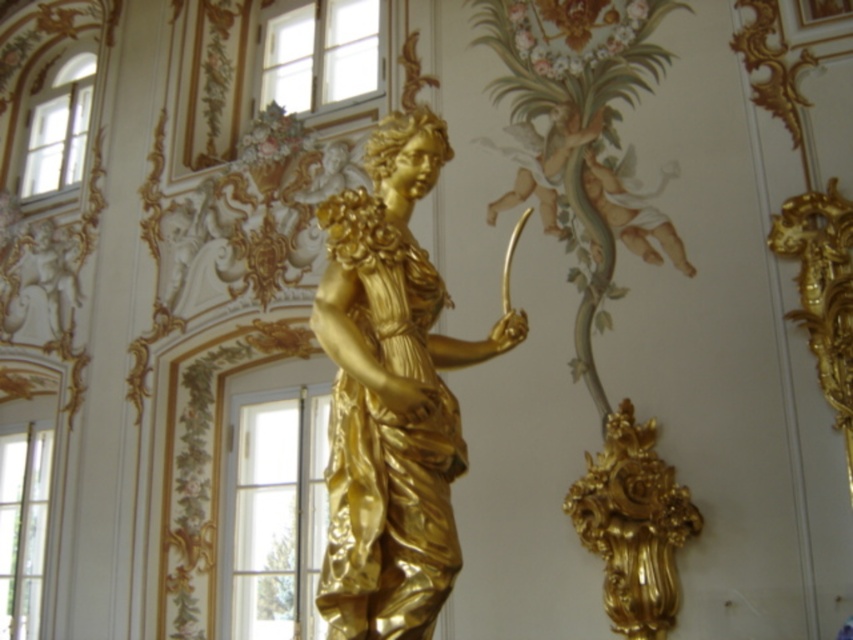
You are an interior designer planning to install a small light above the golden statue. You have two options for placement based on coordinates in the image. The first option is at point (329, 621) and the second at point (663, 518). Which point is closer to the viewer and thus better for a light that needs to illuminate the statue effectively?

Point (329, 621) is closer to the viewer than point (663, 518), so it would be better for illuminating the statue effectively.

You are an interior designer planning to place a new decorative item in the space. You have a choice between placing it either to the left or right of the gold ornate vase at lower right. However, you must ensure it doesn not block the view of the gold polished statue at center. Based on their positions, which side should you choose?

You should place the new decorative item to the right of the gold ornate vase at lower right. Since the gold polished statue at center is positioned over the gold ornate vase at lower right, placing the item to the right would keep it out of the direct line of sight to the statue, thus not blocking its view.

You are an art conservator examining the image. You need to clean both the gold polished statue at center and the gold ornate vase at lower right. Which object should you start with if you want to work on the one closest to you first?

You should start with the gold polished statue at center because it is closer to the viewer than the gold ornate vase at lower right.